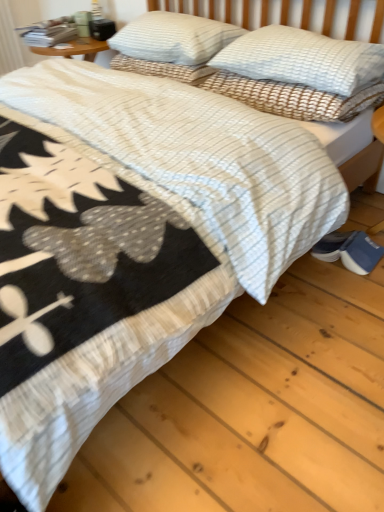
Question: Looking at the image, does white textured pillow at upper center, placed as the 3th pillow when sorted from left to right, seem bigger or smaller compared to white textured pillow at upper right, placed as the second pillow when sorted from right to left?

Choices:
 (A) small
 (B) big

Answer: (B)

Question: Is point (251, 44) closer or farther from the camera than point (299, 86)?

Choices:
 (A) closer
 (B) farther

Answer: (B)

Question: Based on their relative distances, which object is farther from the white textured pillow at upper center, the first pillow from the right?

Choices:
 (A) white textured pillow at upper right, the second pillow positioned from the left
 (B) blue suede shoes at lower right
 (C) white textured pillow at upper center, the first pillow in the left-to-right sequence

Answer: (B)

Question: Based on their relative distances, which object is nearer to the white textured pillow at upper center, placed as the 3th pillow when sorted from left to right?

Choices:
 (A) white textured pillow at upper center, the first pillow in the left-to-right sequence
 (B) blue suede shoes at lower right
 (C) white textured pillow at upper right, the second pillow positioned from the left

Answer: (C)